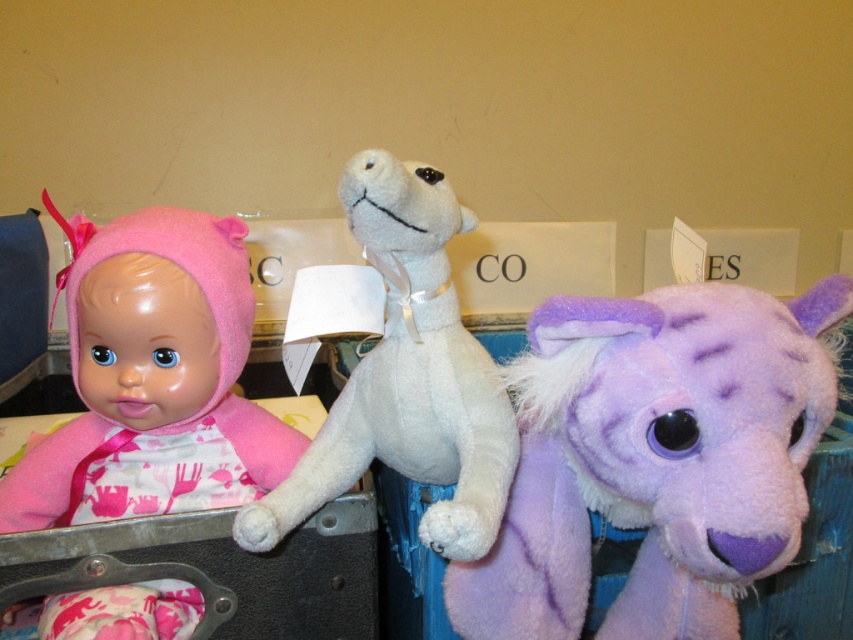
Is point (746, 493) closer to camera compared to point (82, 497)?

Yes, it is.

Is purple plush horse at right thinner than matte pink fabric doll at left?

No, purple plush horse at right is not thinner than matte pink fabric doll at left.

Which is behind, point (701, 625) or point (202, 326)?

The point (202, 326) is more distant.

Image resolution: width=853 pixels, height=640 pixels. Find the location of `purple plush horse at right`. purple plush horse at right is located at coordinates pos(654,458).

Based on the photo, is matte pink fabric doll at left to the left of white soft stuffed animal at center from the viewer's perspective?

Correct, you'll find matte pink fabric doll at left to the left of white soft stuffed animal at center.

Which is more to the right, matte pink fabric doll at left or white soft stuffed animal at center?

white soft stuffed animal at center

Is point (146, 621) positioned before point (442, 257)?

Yes.

At what (x,y) coordinates should I click in order to perform the action: click on matte pink fabric doll at left. Please return your answer as a coordinate pair (x, y). This screenshot has width=853, height=640. Looking at the image, I should click on (154, 378).

Does purple plush horse at right have a greater width compared to white soft stuffed animal at center?

Indeed, purple plush horse at right has a greater width compared to white soft stuffed animal at center.

Which of these two, purple plush horse at right or white soft stuffed animal at center, stands shorter?

With less height is white soft stuffed animal at center.

Is point (796, 529) farther from viewer compared to point (376, 244)?

That is False.

What are the coordinates of `purple plush horse at right` in the screenshot? It's located at (654, 458).